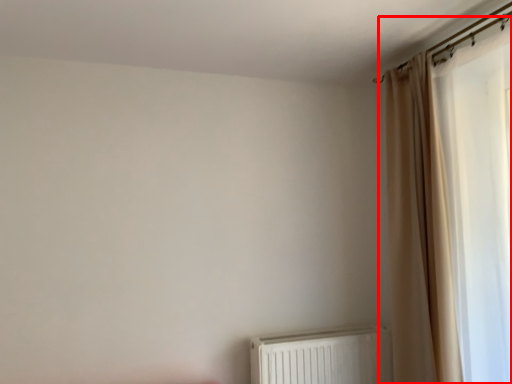
Question: From the image, what is the correct spatial relationship of curtain (annotated by the red box) in relation to radiator?

Choices:
 (A) left
 (B) right

Answer: (B)